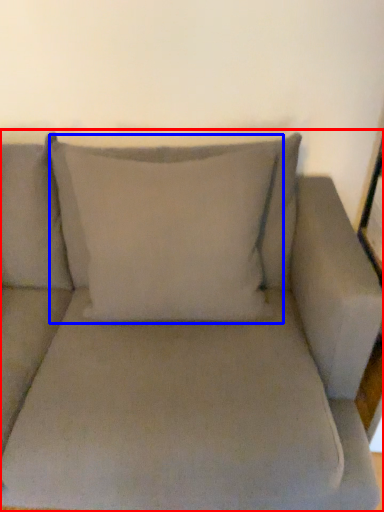
Question: Among these objects, which one is farthest to the camera, studio couch (highlighted by a red box) or pillow (highlighted by a blue box)?

Choices:
 (A) studio couch
 (B) pillow

Answer: (B)